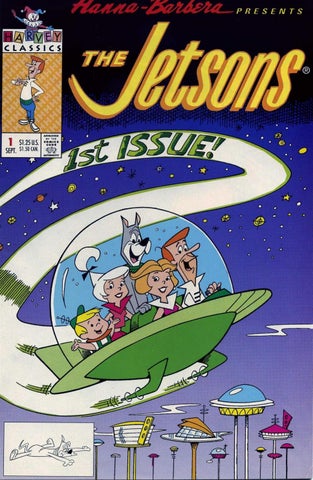
This screenshot has height=480, width=313. In order to click on inset picture in this screenshot , I will do `click(9, 428)`.